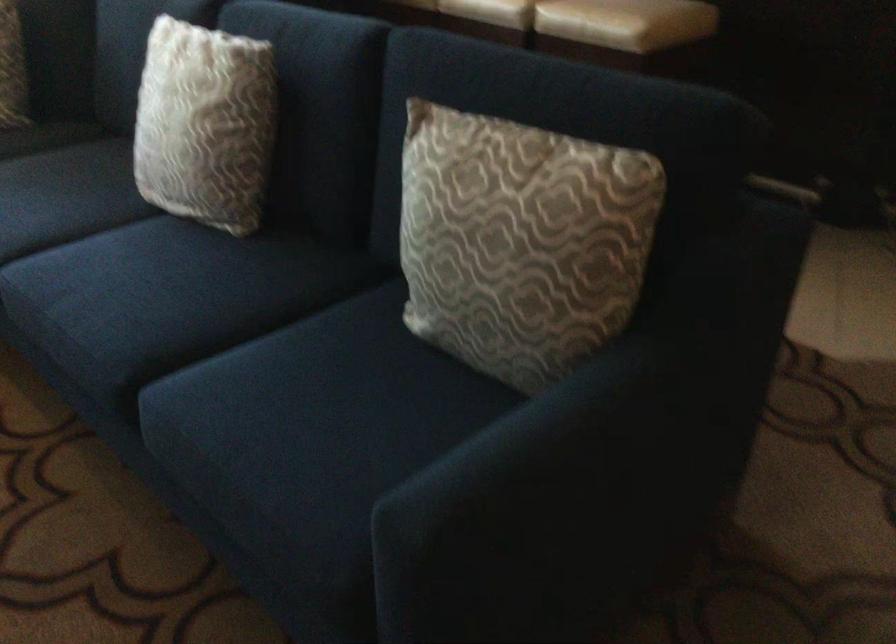
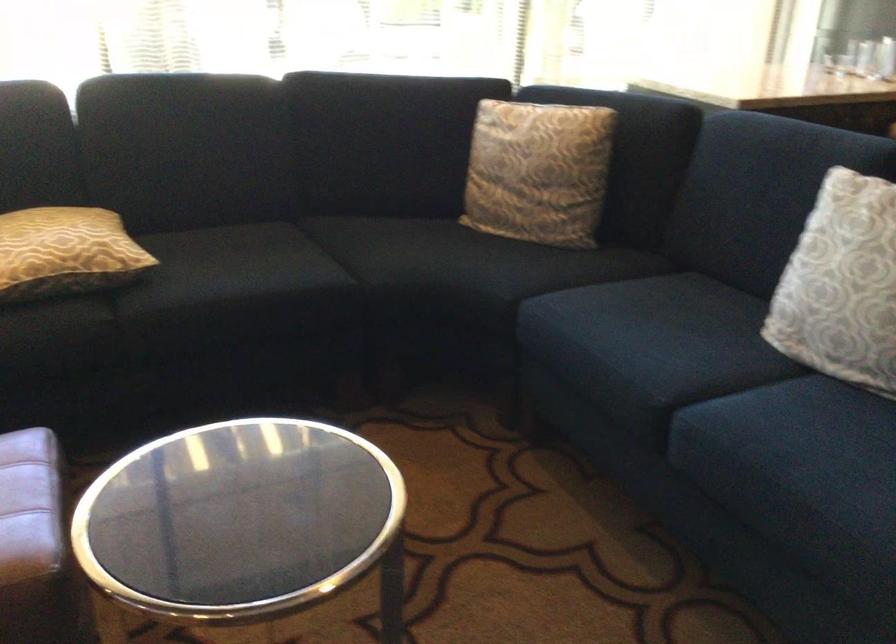
Find the pixel in the second image that matches point (161, 134) in the first image.

(841, 285)